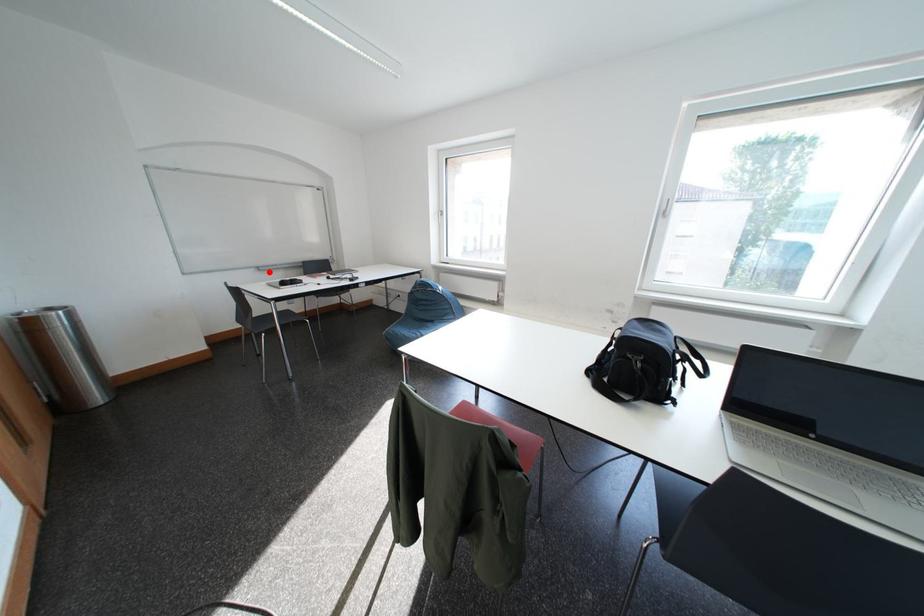
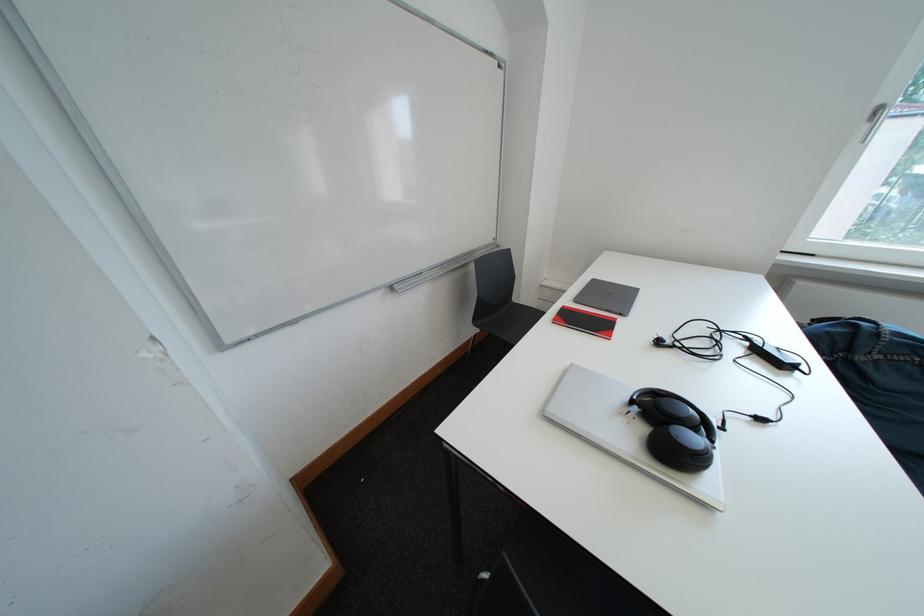
Find the pixel in the second image that matches the highlighted location in the first image.

(403, 292)